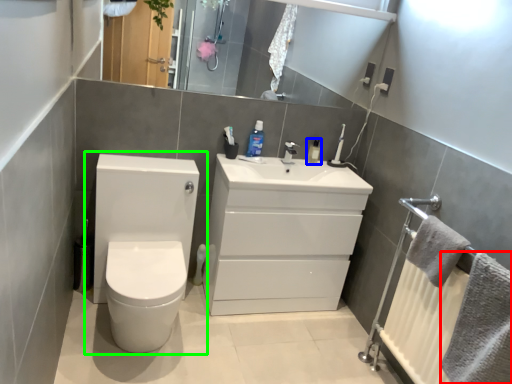
Question: Which object is positioned farthest from bath towel (highlighted by a red box)? Select from mouthwash (highlighted by a blue box) and toilet (highlighted by a green box).

Choices:
 (A) mouthwash
 (B) toilet

Answer: (B)